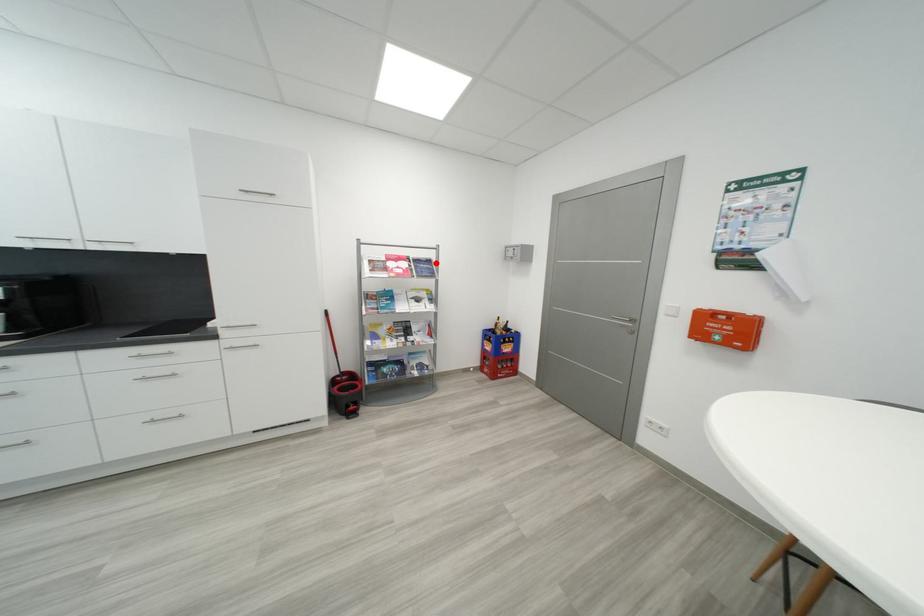
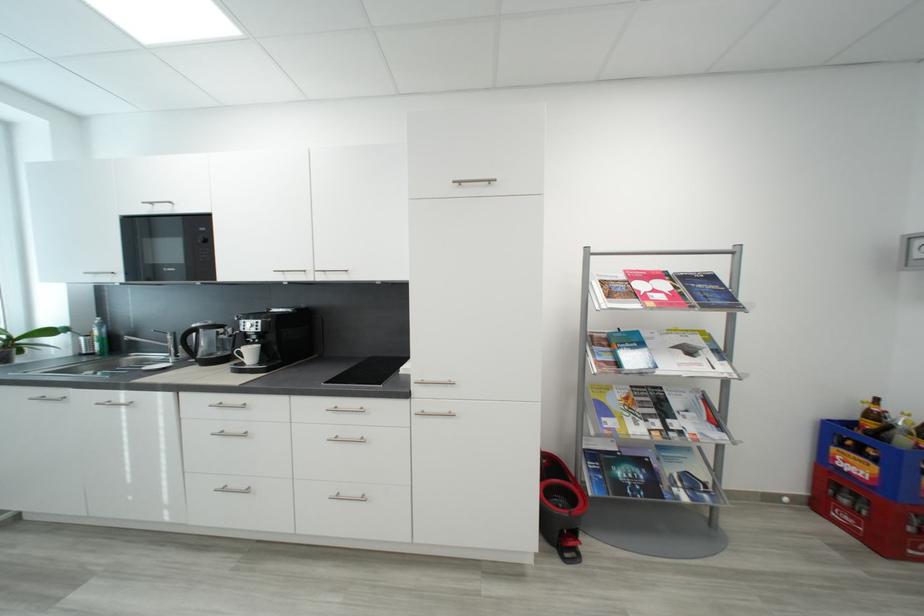
Find the pixel in the second image that matches the highlighted location in the first image.

(718, 280)